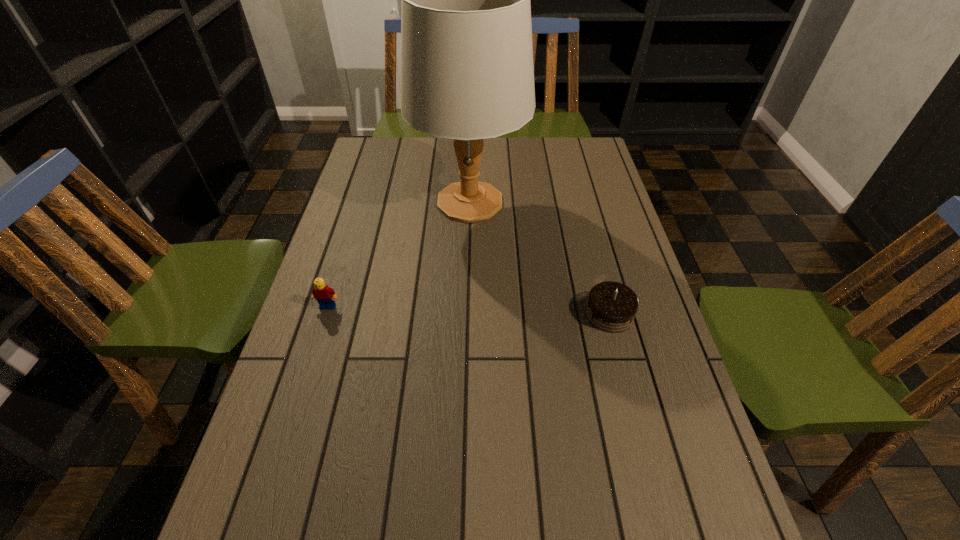
The width and height of the screenshot is (960, 540). Identify the location of the tallest object. (467, 73).

I want to click on table lamp, so (467, 73).

The height and width of the screenshot is (540, 960). What are the coordinates of `Lego` in the screenshot? It's located at (324, 295).

Locate an element on the screen. This screenshot has width=960, height=540. chocolate cake is located at coordinates (611, 307).

Locate an element on the screen. The width and height of the screenshot is (960, 540). free space located 0.200m on the front of the table lamp is located at coordinates (468, 289).

At what (x,y) coordinates should I click in order to perform the action: click on free spot located 0.150m on the front-facing side of the Lego. Please return your answer as a coordinate pair (x, y). Looking at the image, I should click on (311, 361).

Where is `free space located 0.050m on the front of the rightmost object`? free space located 0.050m on the front of the rightmost object is located at coordinates (618, 350).

Where is `object that is at the far edge`? Image resolution: width=960 pixels, height=540 pixels. object that is at the far edge is located at coordinates (467, 73).

Locate an element on the screen. This screenshot has width=960, height=540. object positioned at the left edge is located at coordinates (324, 295).

At what (x,y) coordinates should I click in order to perform the action: click on object located in the right edge section of the desktop. Please return your answer as a coordinate pair (x, y). The width and height of the screenshot is (960, 540). Looking at the image, I should click on 611,307.